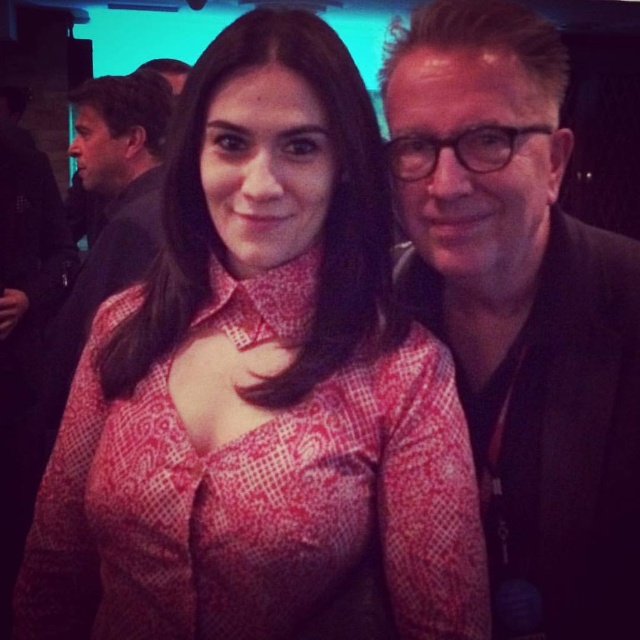
Can you confirm if matte black suit at right is smaller than matte black suit at center?

Correct, matte black suit at right occupies less space than matte black suit at center.

Is point (502, 104) positioned in front of point (51, 420)?

Yes, point (502, 104) is in front of point (51, 420).

The width and height of the screenshot is (640, 640). Find the location of `matte black suit at right`. matte black suit at right is located at coordinates coord(522,312).

Who is taller, pink patterned blouse at center or matte black suit at right?

With more height is matte black suit at right.

Can you confirm if pink patterned blouse at center is positioned below matte black suit at right?

Yes, pink patterned blouse at center is below matte black suit at right.

What do you see at coordinates (260, 392) in the screenshot? I see `pink patterned blouse at center` at bounding box center [260, 392].

Image resolution: width=640 pixels, height=640 pixels. I want to click on pink patterned blouse at center, so click(x=260, y=392).

Who is more forward, (292,518) or (144,88)?

Point (292,518)

Can you confirm if pink patterned blouse at center is positioned below matte black suit at center?

Correct, pink patterned blouse at center is located below matte black suit at center.

Between point (92, 534) and point (154, 224), which one is positioned in front?

Positioned in front is point (92, 534).

The image size is (640, 640). Find the location of `pink patterned blouse at center`. pink patterned blouse at center is located at coordinates (260, 392).